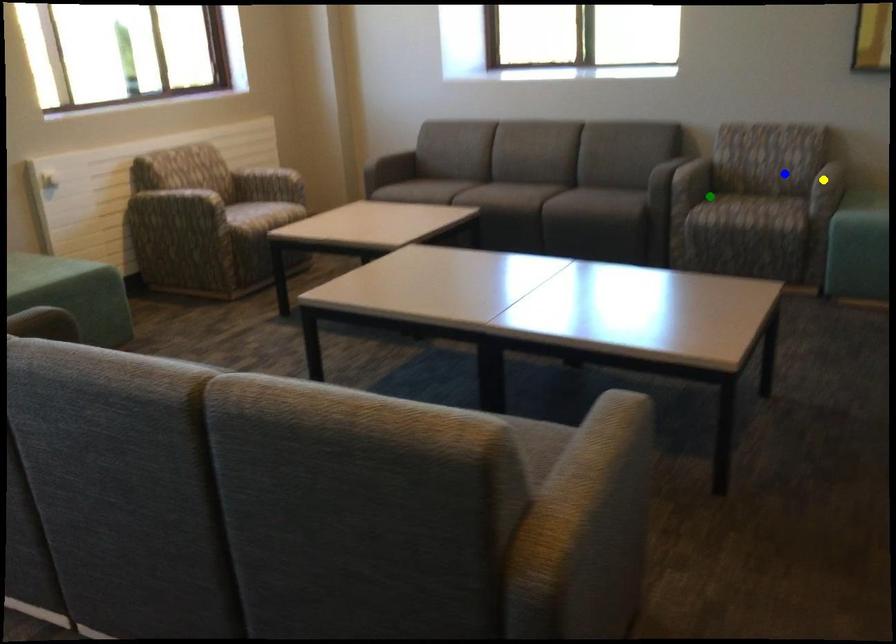
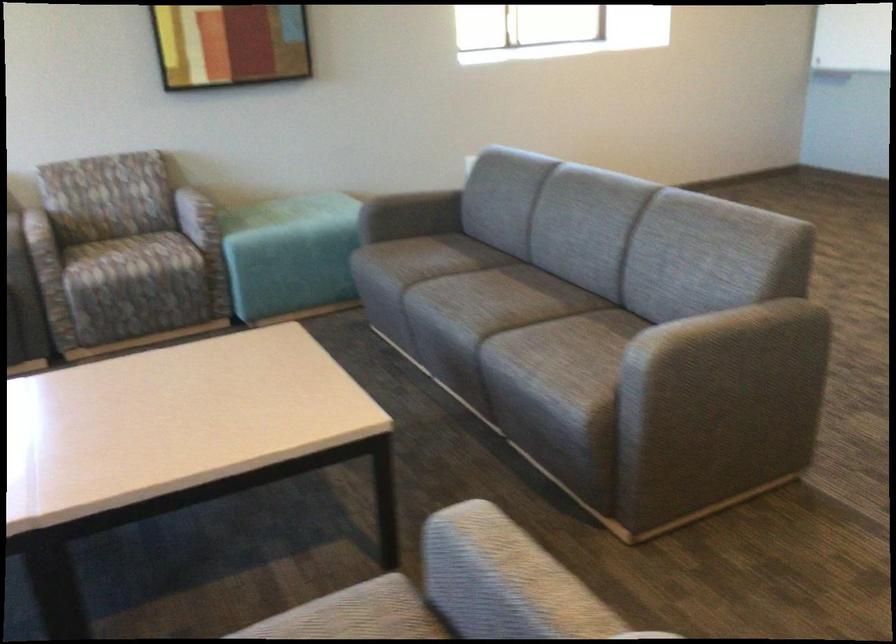
I am providing you with two images of the same scene from different viewpoints. Three points are marked in image1. Which point corresponds to a part or object that is occluded in image2?In image1, three points are marked. Which of them correspond to a part or object that is occluded in image2?Among the three points shown in image1, which one corresponds to a part or object that is no longer visible due to occlusion in image2?

yellow point cannot be seen in image2.